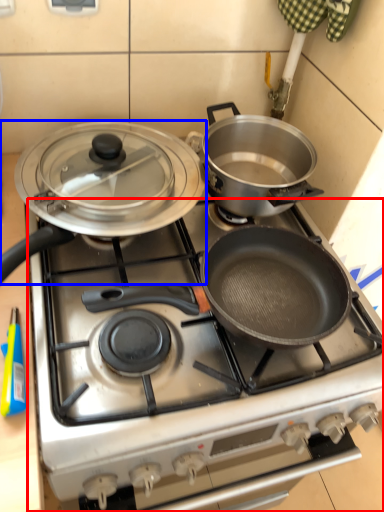
Question: Which object is closer to the camera taking this photo, gas stove (highlighted by a red box) or kitchen appliance (highlighted by a blue box)?

Choices:
 (A) gas stove
 (B) kitchen appliance

Answer: (A)